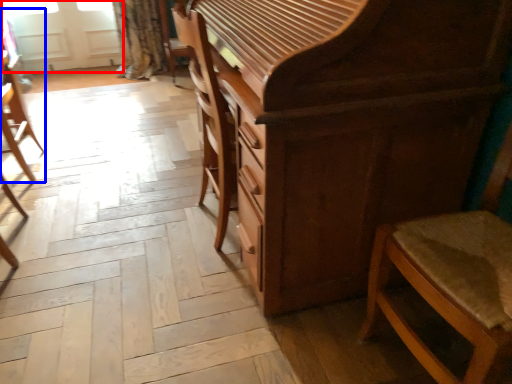
Question: Among these objects, which one is nearest to the camera, screen door (highlighted by a red box) or chair (highlighted by a blue box)?

Choices:
 (A) screen door
 (B) chair

Answer: (B)